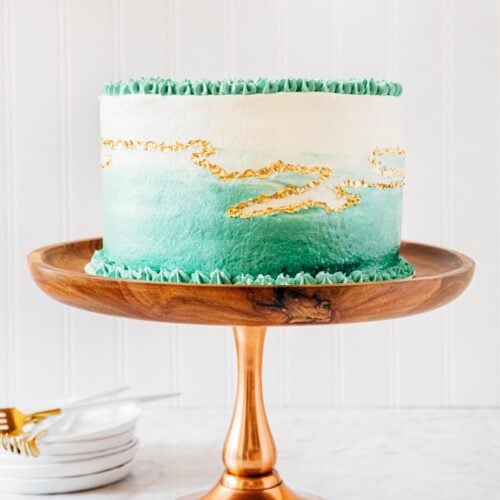
I want to click on small plate, so click(111, 426), click(112, 438), click(105, 452), click(104, 462), click(104, 481).